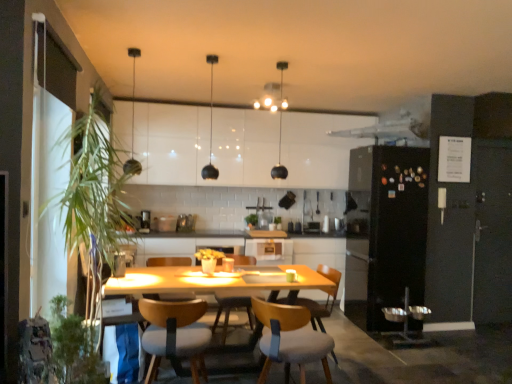
Question: In which direction should I rotate to look at green leafy plant at center, the 3th plant in the left-to-right sequence?

Choices:
 (A) right
 (B) left

Answer: (B)

Question: Considering the relative positions of matte black pendant light at upper center, placed as the third light fixture when sorted from right to left, and metallic silver toaster at center, acting as the 1th appliance starting from the right, in the image provided, is matte black pendant light at upper center, placed as the third light fixture when sorted from right to left, to the left of metallic silver toaster at center, acting as the 1th appliance starting from the right, from the viewer's perspective?

Choices:
 (A) yes
 (B) no

Answer: (A)

Question: Is matte black pendant light at upper center, placed as the third light fixture when sorted from right to left, not close to metallic silver toaster at center, which is the 2th appliance from left to right?

Choices:
 (A) yes
 (B) no

Answer: (A)

Question: Considering the relative sizes of matte black pendant light at upper center, which is the first light fixture in left-to-right order, and metallic silver toaster at center, which is the 2th appliance from left to right, in the image provided, is matte black pendant light at upper center, which is the first light fixture in left-to-right order, wider than metallic silver toaster at center, which is the 2th appliance from left to right,?

Choices:
 (A) no
 (B) yes

Answer: (A)

Question: From a real-world perspective, is matte black pendant light at upper center, placed as the third light fixture when sorted from right to left, under metallic silver toaster at center, acting as the 1th appliance starting from the right?

Choices:
 (A) yes
 (B) no

Answer: (B)

Question: Is matte black pendant light at upper center, which is the first light fixture in left-to-right order, taller than metallic silver toaster at center, which is the 2th appliance from left to right?

Choices:
 (A) yes
 (B) no

Answer: (A)

Question: From the image's perspective, is matte black pendant light at upper center, placed as the third light fixture when sorted from right to left, under metallic silver toaster at center, acting as the 1th appliance starting from the right?

Choices:
 (A) no
 (B) yes

Answer: (A)

Question: Can you see metallic silver toaster at center, which is the 2th appliance from left to right, touching black matte pendant light at center, acting as the 2th light fixture starting from the left?

Choices:
 (A) yes
 (B) no

Answer: (B)

Question: Does metallic silver toaster at center, acting as the 1th appliance starting from the right, have a larger size compared to black matte pendant light at center, acting as the 2th light fixture starting from the left?

Choices:
 (A) no
 (B) yes

Answer: (A)

Question: Does metallic silver toaster at center, acting as the 1th appliance starting from the right, have a greater width compared to black matte pendant light at center, acting as the 2th light fixture starting from the left?

Choices:
 (A) no
 (B) yes

Answer: (B)

Question: Can you confirm if metallic silver toaster at center, acting as the 1th appliance starting from the right, is smaller than black matte pendant light at center, acting as the 2th light fixture starting from the left?

Choices:
 (A) yes
 (B) no

Answer: (A)

Question: Are metallic silver toaster at center, which is the 2th appliance from left to right, and black matte pendant light at center, arranged as the second light fixture when viewed from the right, located far from each other?

Choices:
 (A) no
 (B) yes

Answer: (A)

Question: Is metallic silver toaster at center, which is the 2th appliance from left to right, facing towards black matte pendant light at center, acting as the 2th light fixture starting from the left?

Choices:
 (A) yes
 (B) no

Answer: (B)

Question: From the image's perspective, is green leafy plant at left, positioned as the 2th plant in back-to-front order, located beneath white glossy cabinet at center, arranged as the 1th cabinetry when viewed from the back?

Choices:
 (A) yes
 (B) no

Answer: (B)